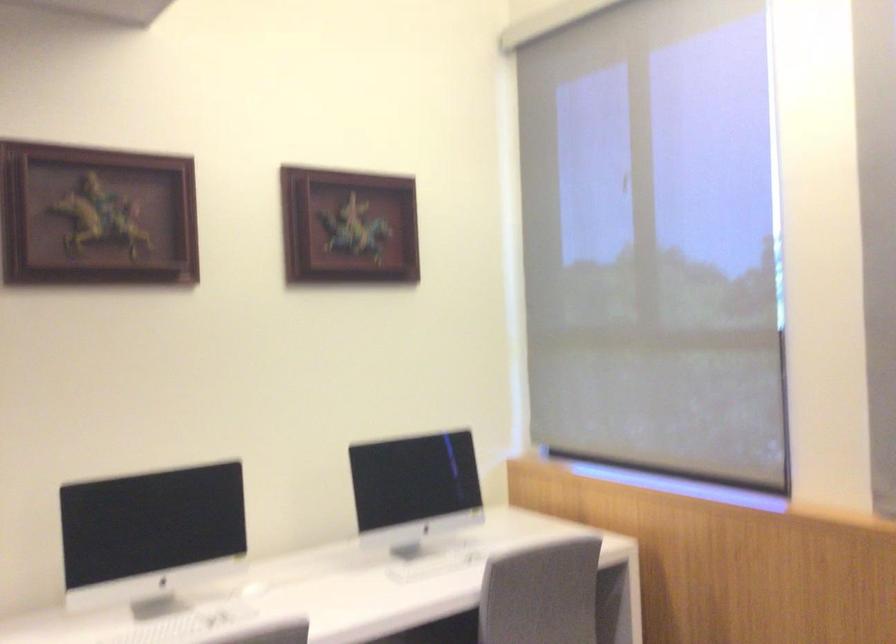
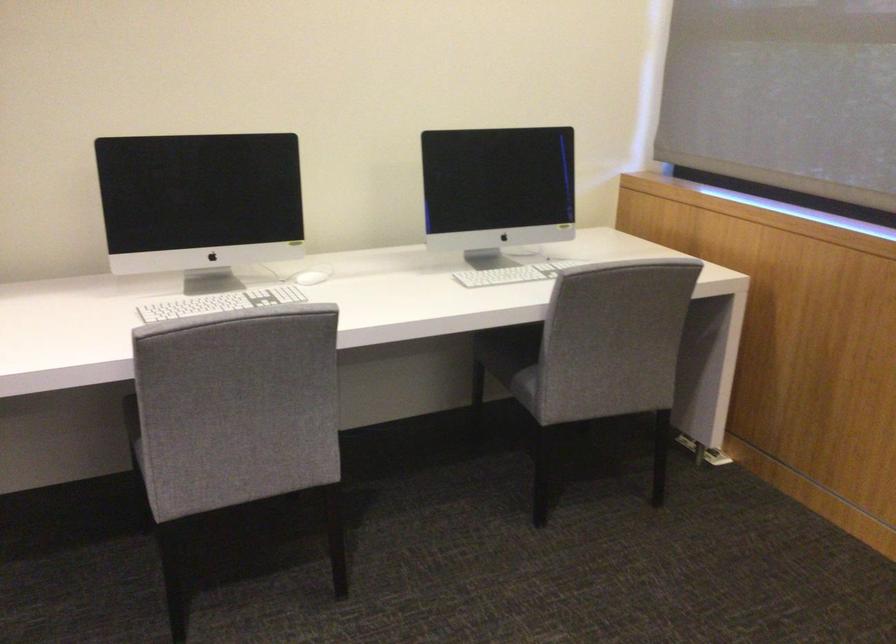
The point at (450, 563) is marked in the first image. Where is the corresponding point in the second image?

(519, 270)